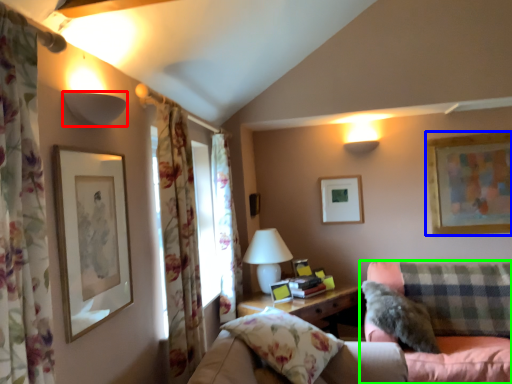
Question: Based on their relative distances, which object is nearer to lamp (highlighted by a red box)? Choose from picture frame (highlighted by a blue box) and studio couch (highlighted by a green box).

Choices:
 (A) picture frame
 (B) studio couch

Answer: (B)